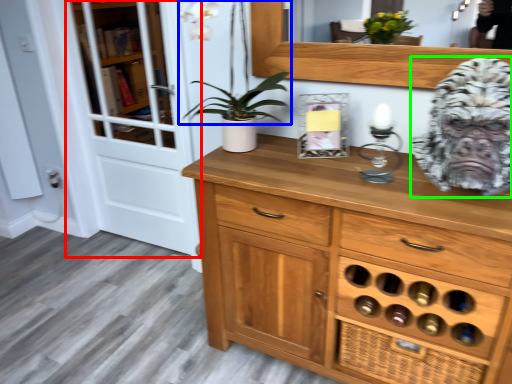
Question: Which object is positioned farthest from screen door (highlighted by a red box)? Select from plant (highlighted by a blue box) and gorilla (highlighted by a green box).

Choices:
 (A) plant
 (B) gorilla

Answer: (B)